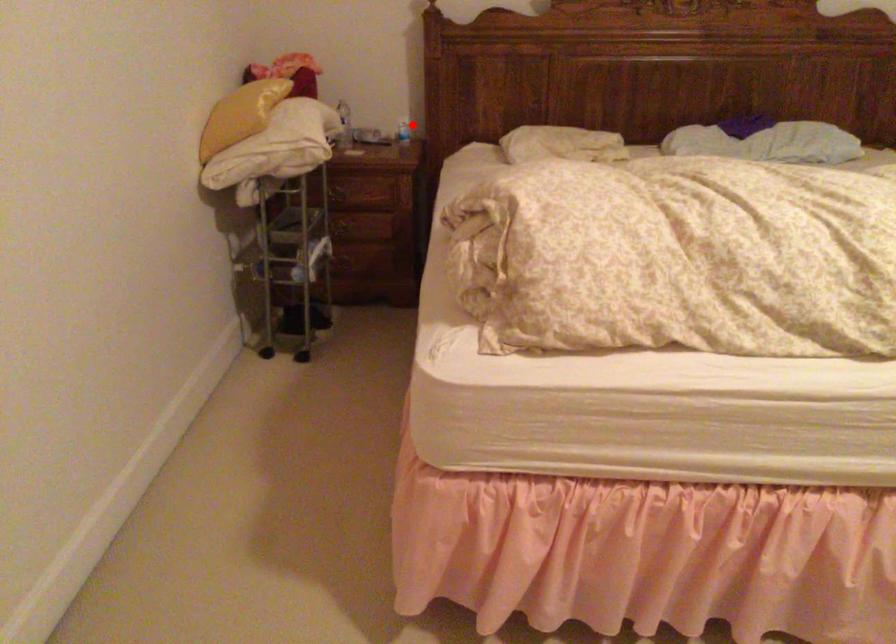
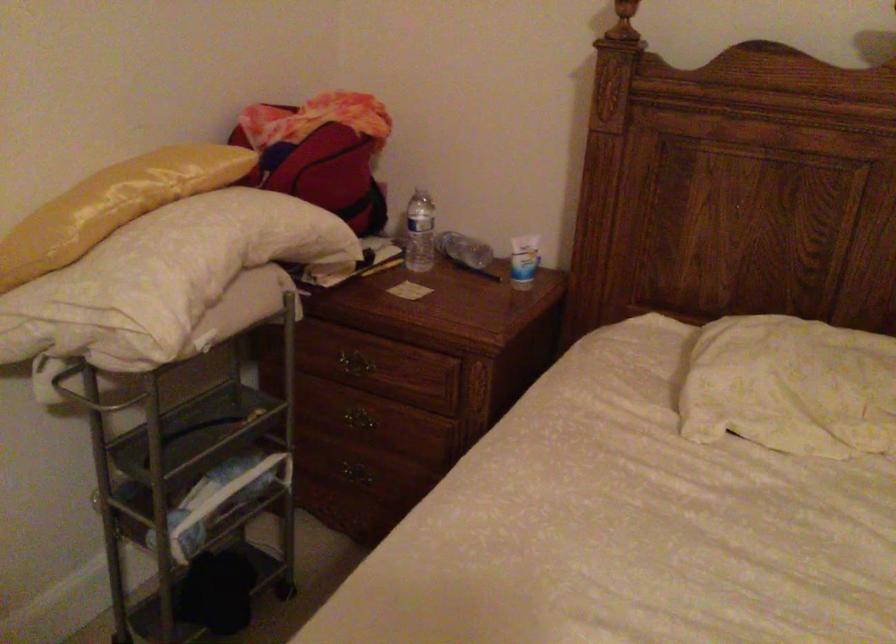
Question: I am providing you with two images of the same scene from different viewpoints. A red point is marked on the first image. Can you still see the location of the red point in image 2?

Choices:
 (A) Yes
 (B) No

Answer: (A)